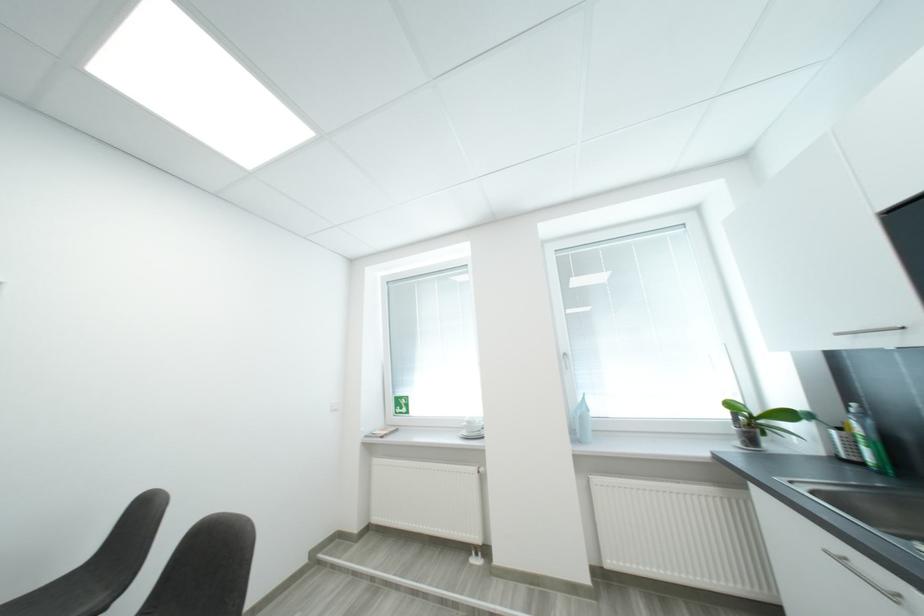
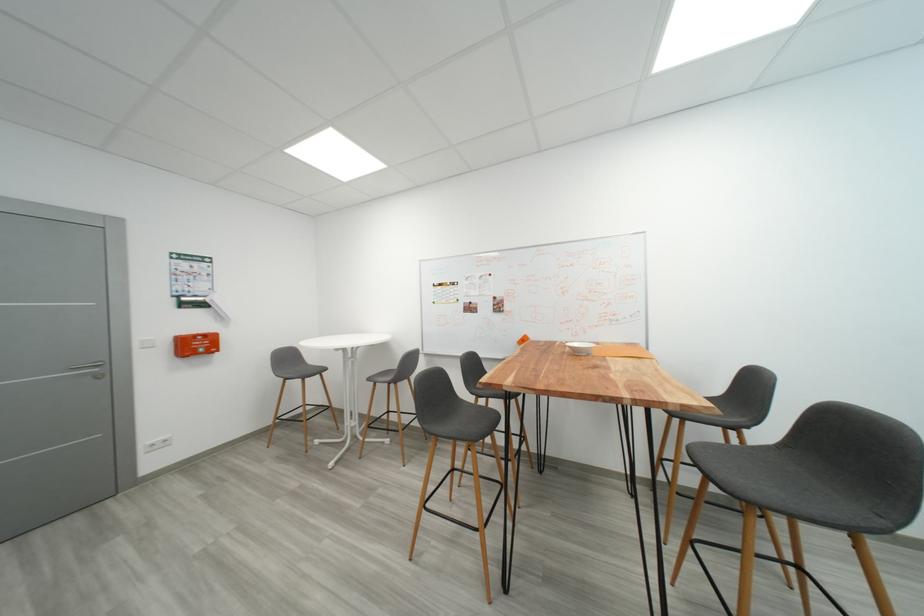
Question: Based on the continuous images, in which direction is the camera rotating? Reply with the corresponding letter.

Choices:
 (A) Left
 (B) Right
 (C) Up
 (D) Down

Answer: (A)